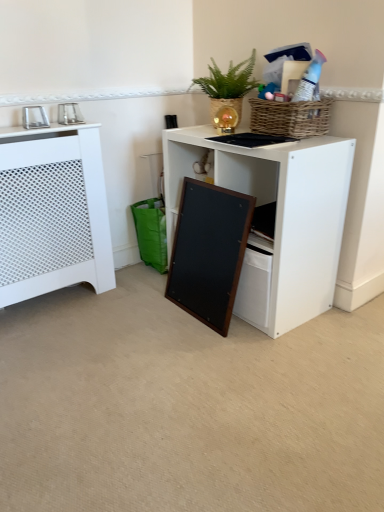
Question: From the image's perspective, relative to white matte desk at center, is metallic silver photo frame at upper left, which is the first appliance from right to left, above or below?

Choices:
 (A) above
 (B) below

Answer: (A)

Question: Is metallic silver photo frame at upper left, which is the first appliance from right to left, wider or thinner than white matte desk at center?

Choices:
 (A) thin
 (B) wide

Answer: (A)

Question: Which object is the farthest from the wooden frame at lower center?

Choices:
 (A) metallic silver photo frame at upper left, the 2th appliance viewed from the right
 (B) metallic silver photo frame at upper left, which is the first appliance from right to left
 (C) white matte desk at center
 (D) green woven basket at upper center
 (E) white perforated radiator at left

Answer: (A)

Question: Which of these objects is positioned closest to the wooden frame at lower center?

Choices:
 (A) metallic silver photo frame at upper left, the 2th appliance when ordered from left to right
 (B) white matte desk at center
 (C) white perforated radiator at left
 (D) green woven basket at upper center
 (E) metallic silver photo frame at upper left, the first appliance viewed from the left

Answer: (B)